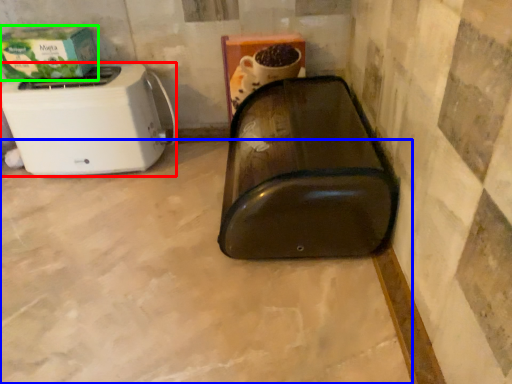
Question: Which is nearer to the toaster (highlighted by a red box)? concrete (highlighted by a blue box) or box (highlighted by a green box).

Choices:
 (A) concrete
 (B) box

Answer: (B)